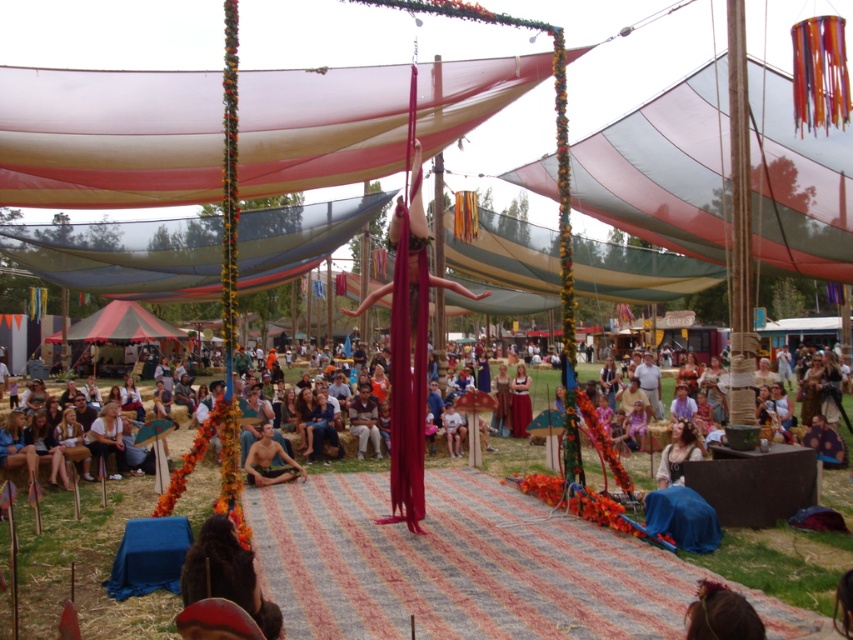
Is red fabric canopy at upper center further to camera compared to smooth skin person at center?

That is True.

Identify the location of red fabric canopy at upper center. This screenshot has width=853, height=640. (664, 168).

What do you see at coordinates (664, 168) in the screenshot? The width and height of the screenshot is (853, 640). I see `red fabric canopy at upper center` at bounding box center [664, 168].

This screenshot has width=853, height=640. I want to click on red fabric canopy at upper center, so click(x=664, y=168).

Can you confirm if smooth skin person at center is positioned below shiny metallic meditating person at center?

Actually, smooth skin person at center is above shiny metallic meditating person at center.

Does smooth skin person at center come in front of shiny metallic meditating person at center?

Yes, it is in front of shiny metallic meditating person at center.

The height and width of the screenshot is (640, 853). In order to click on smooth skin person at center in this screenshot , I will do `click(518, 458)`.

Which is more to the right, shiny metallic meditating person at center or brown leather purse at center?

Positioned to the right is brown leather purse at center.

Which is in front, point (263, 465) or point (701, 456)?

Point (701, 456)

Does point (260, 436) lie in front of point (682, 444)?

That is False.

Locate an element on the screen. The width and height of the screenshot is (853, 640). shiny metallic meditating person at center is located at coordinates (270, 460).